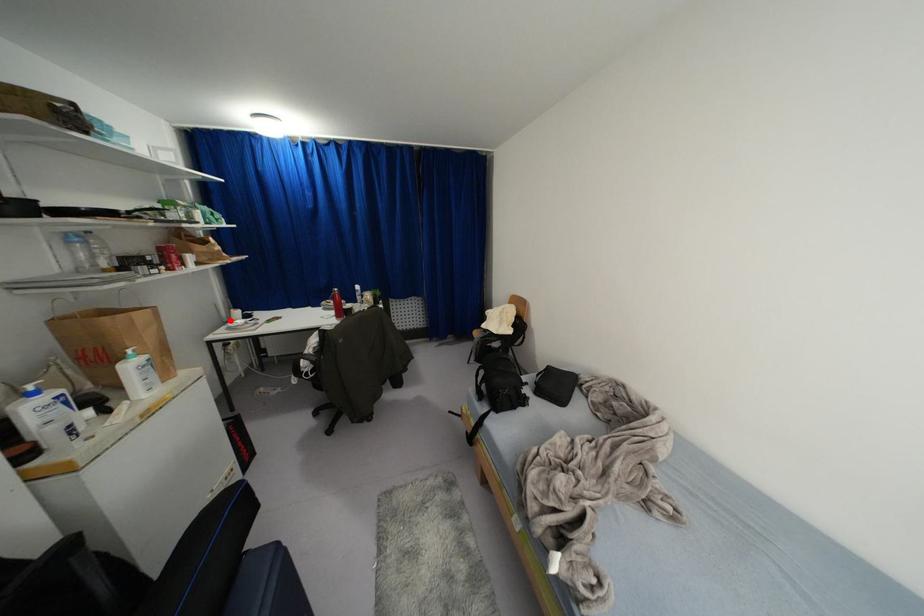
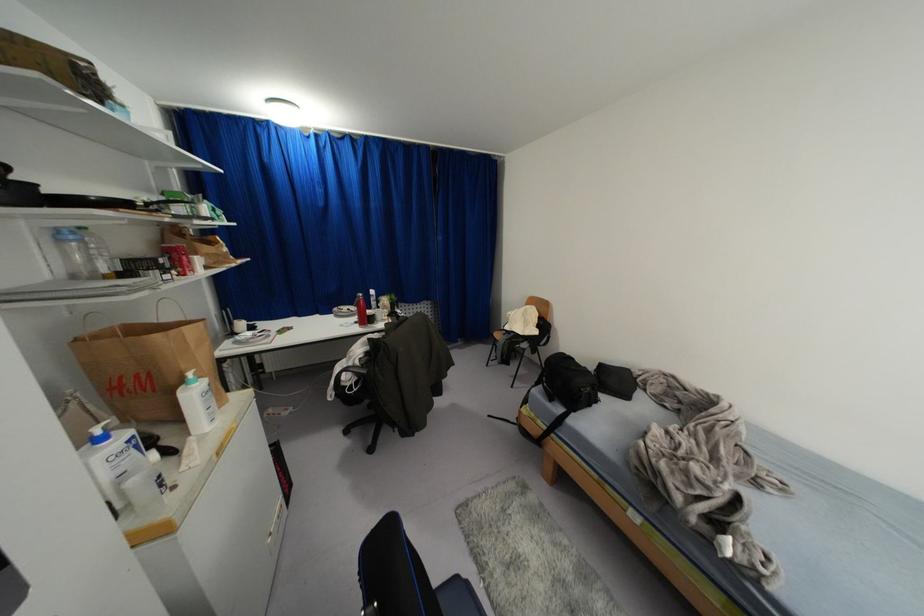
Find the pixel in the second image that matches the highlighted location in the first image.

(234, 333)